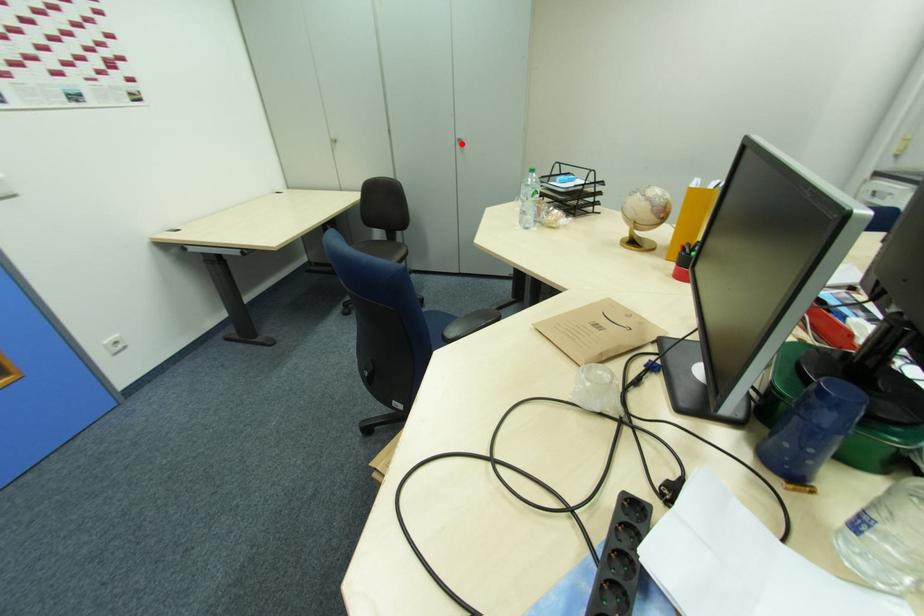
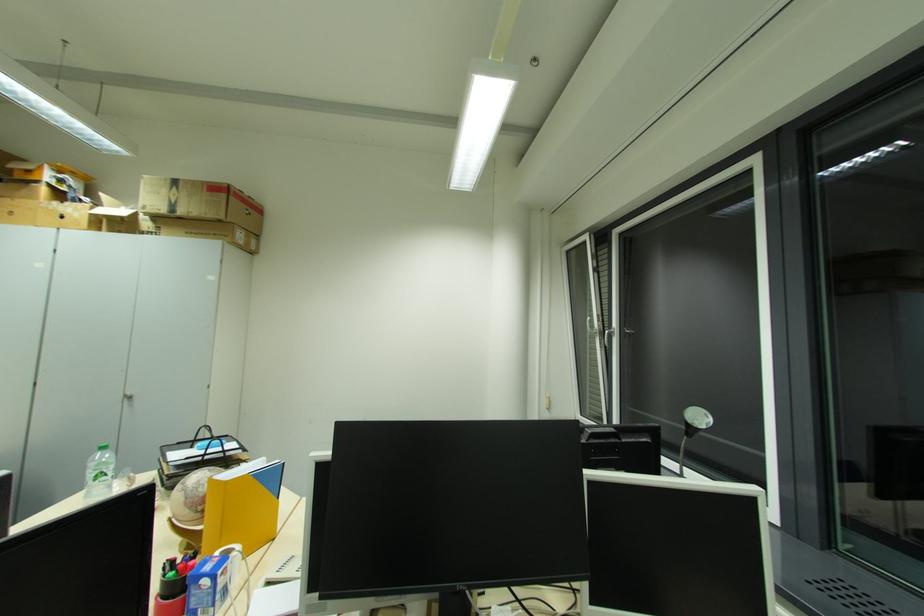
Find the pixel in the second image that matches the highlighted location in the first image.

(128, 400)